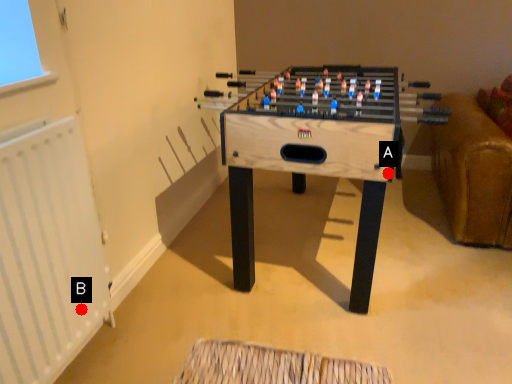
Question: Two points are circled on the image, labeled by A and B beside each circle. Which of the following is the closest to the observer?

Choices:
 (A) A is closer
 (B) B is closer

Answer: (B)